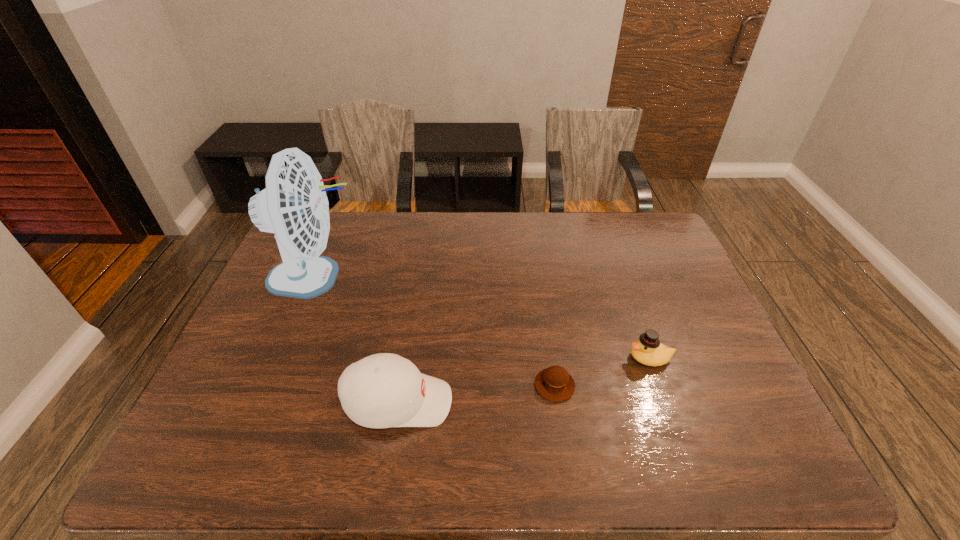
In the image, there is a desktop. Where is `free space at the near edge`? free space at the near edge is located at coordinates (271, 436).

Where is `vacant position at the left edge of the desktop`? vacant position at the left edge of the desktop is located at coordinates (270, 296).

Image resolution: width=960 pixels, height=540 pixels. Find the location of `vacant space at the right edge`. vacant space at the right edge is located at coordinates (671, 309).

Identify the location of vacant space at the near right corner. This screenshot has width=960, height=540. (732, 463).

You are a GUI agent. You are given a task and a screenshot of the screen. Output one action in this format:
    pyautogui.click(x=<x>, y=<y>)
    Task: Click on the free spot between the leftmost object and the third shortest object
    The height and width of the screenshot is (540, 960).
    Given the screenshot: What is the action you would take?
    click(357, 340)

Image resolution: width=960 pixels, height=540 pixels. Identify the location of free space between the third object from left to right and the fan. (435, 332).

This screenshot has height=540, width=960. In order to click on vacant point located between the second object from left to right and the farthest object in this screenshot , I will do `click(357, 340)`.

Locate an element on the screen. This screenshot has width=960, height=540. free area in between the duck and the third shortest object is located at coordinates coord(524,380).

At what (x,y) coordinates should I click in order to perform the action: click on free space between the duck and the leftmost object. Please return your answer as a coordinate pair (x, y). The width and height of the screenshot is (960, 540). Looking at the image, I should click on (483, 318).

Where is `free space between the third object from right to left and the third tallest object`? free space between the third object from right to left and the third tallest object is located at coordinates (524, 380).